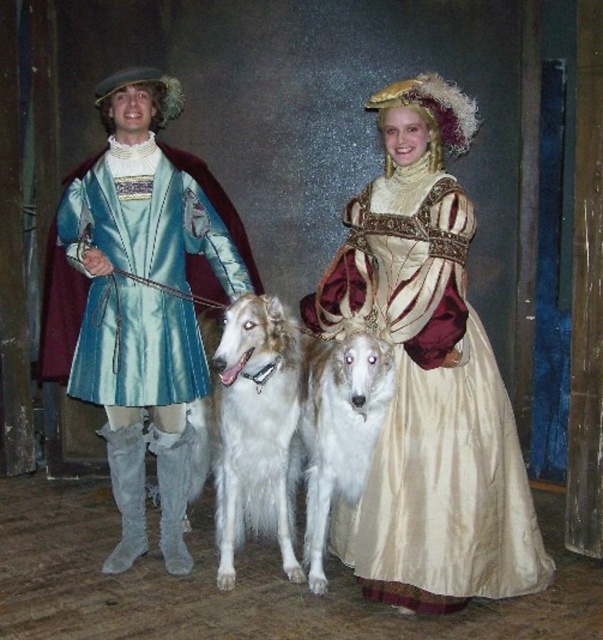
What do you see at coordinates (428, 376) in the screenshot? I see `silky blue coat at center` at bounding box center [428, 376].

Which is below, silky blue coat at center or silky gold dress at center?

Positioned lower is silky gold dress at center.

At what (x,y) coordinates should I click in order to perform the action: click on silky blue coat at center. Please return your answer as a coordinate pair (x, y). Looking at the image, I should click on (428, 376).

Can you confirm if white fluffy dog at center is smaller than white fur dog at center?

No.

Does white fluffy dog at center have a larger size compared to white fur dog at center?

Correct, white fluffy dog at center is larger in size than white fur dog at center.

The width and height of the screenshot is (603, 640). What are the coordinates of `white fluffy dog at center` in the screenshot? It's located at (253, 426).

Is satin blue coat at left closer to the viewer compared to white fluffy dog at center?

No, it is behind white fluffy dog at center.

Is satin blue coat at left taller than white fluffy dog at center?

Yes.

Measure the distance between point (180, 211) and camera.

The distance of point (180, 211) from camera is 3.27 meters.

Locate an element on the screen. This screenshot has height=640, width=603. satin blue coat at left is located at coordinates (140, 298).